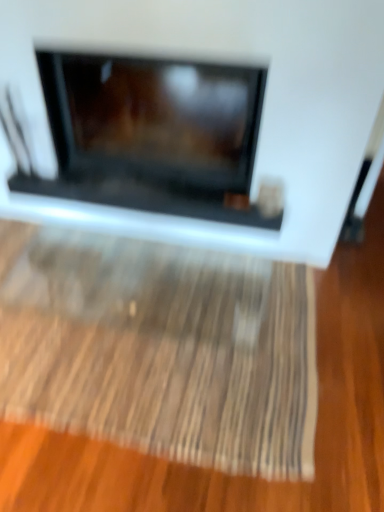
Image resolution: width=384 pixels, height=512 pixels. In order to click on free region under wooden textured mat at center (from a real-world perspective) in this screenshot , I will do `click(132, 321)`.